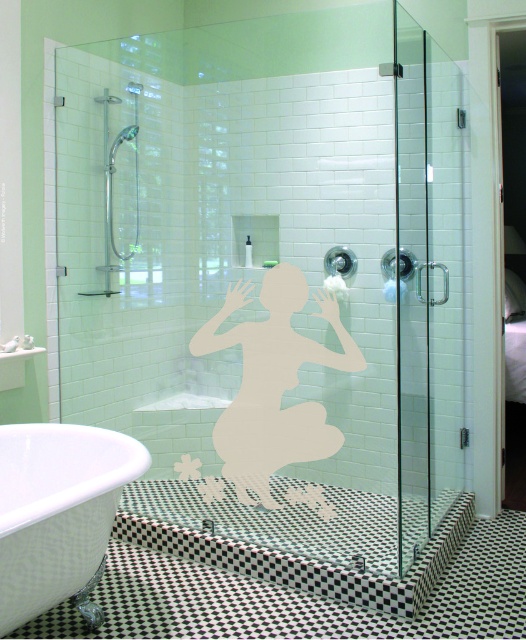
You are standing at the entrance of the bathroom and want to reach the white glossy bathtub at lower left. According to the coordinates provided, in which direction should you move from your current position?

You should move towards the lower left direction to reach the white glossy bathtub at lower left as it is located at point (57, 513).

You are a guest in this bathroom and want to take a shower. The shower is behind the white glossy bathtub at lower left and the white matte silhouette at center. Which object should you move first to access the shower?

The white glossy bathtub at lower left is in front of the white matte silhouette at center. To access the shower, you should move the white glossy bathtub at lower left first because it is blocking the path to the shower.